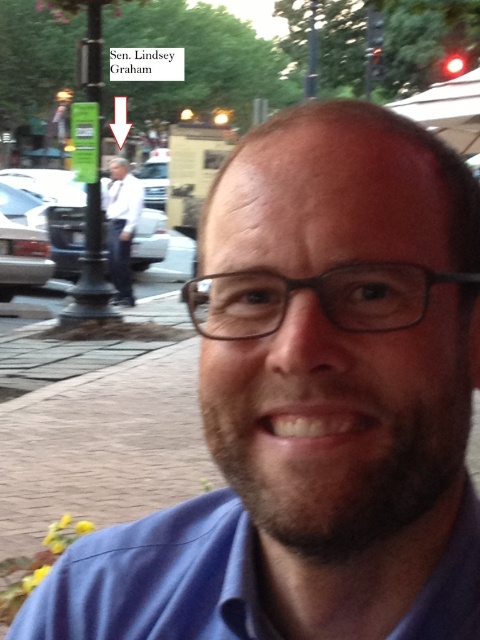
You are a photographer setting up for a group photo. You notice two shirts in the frame. The blue cotton dress shirt at center and the white shirt at left. Which shirt should you adjust to ensure both are visible in the photo, considering their sizes?

The blue cotton dress shirt at center has a smaller size compared to white shirt at left. To ensure both are visible, you should adjust the white shirt at left to be closer to the camera or smaller in the frame to balance their sizes.

You are a photographer adjusting your camera settings to focus on the blue cotton dress shirt at center and the white shirt at left. Which shirt should you focus on first to ensure the subject in front is sharp?

The blue cotton dress shirt at center is in front of the white shirt at left, so you should focus on the blue cotton dress shirt at center first to ensure the subject in front is sharp.

What is the object located at the coordinates point (156, 579)?

The point (156, 579) marks the blue cotton dress shirt at center.